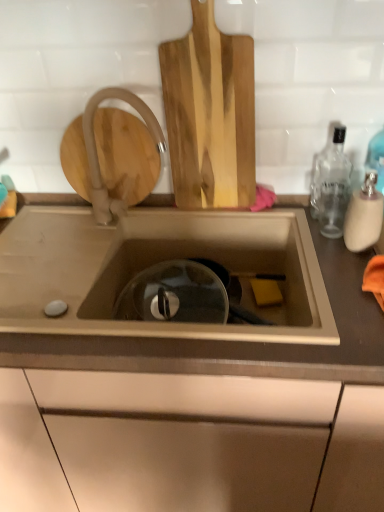
Question: Is there a large distance between natural wood cutting board at upper center and matte white faucet at upper left?

Choices:
 (A) yes
 (B) no

Answer: (B)

Question: Can you confirm if natural wood cutting board at upper center is shorter than matte white faucet at upper left?

Choices:
 (A) yes
 (B) no

Answer: (B)

Question: From the image's perspective, is natural wood cutting board at upper center over matte white faucet at upper left?

Choices:
 (A) yes
 (B) no

Answer: (A)

Question: Is natural wood cutting board at upper center with matte white faucet at upper left?

Choices:
 (A) yes
 (B) no

Answer: (B)

Question: From a real-world perspective, is natural wood cutting board at upper center over matte white faucet at upper left?

Choices:
 (A) no
 (B) yes

Answer: (B)

Question: Is matte white faucet at upper left surrounded by natural wood cutting board at upper center?

Choices:
 (A) no
 (B) yes

Answer: (A)

Question: Could you tell me if matte white faucet at upper left is turned towards natural wood cutting board at upper center?

Choices:
 (A) yes
 (B) no

Answer: (B)

Question: Is matte white faucet at upper left positioned far away from natural wood cutting board at upper center?

Choices:
 (A) no
 (B) yes

Answer: (A)

Question: Can you confirm if matte white faucet at upper left is thinner than natural wood cutting board at upper center?

Choices:
 (A) no
 (B) yes

Answer: (B)

Question: From a real-world perspective, is matte white faucet at upper left located higher than natural wood cutting board at upper center?

Choices:
 (A) no
 (B) yes

Answer: (A)

Question: Is matte white faucet at upper left taller than natural wood cutting board at upper center?

Choices:
 (A) yes
 (B) no

Answer: (B)

Question: Is matte white faucet at upper left behind natural wood cutting board at upper center?

Choices:
 (A) yes
 (B) no

Answer: (A)

Question: Is translucent glass bottle at right, which ranks as the first bottle in front-to-back order, at the right side of clear glass bottle at right, acting as the 2th bottle starting from the front?

Choices:
 (A) yes
 (B) no

Answer: (A)